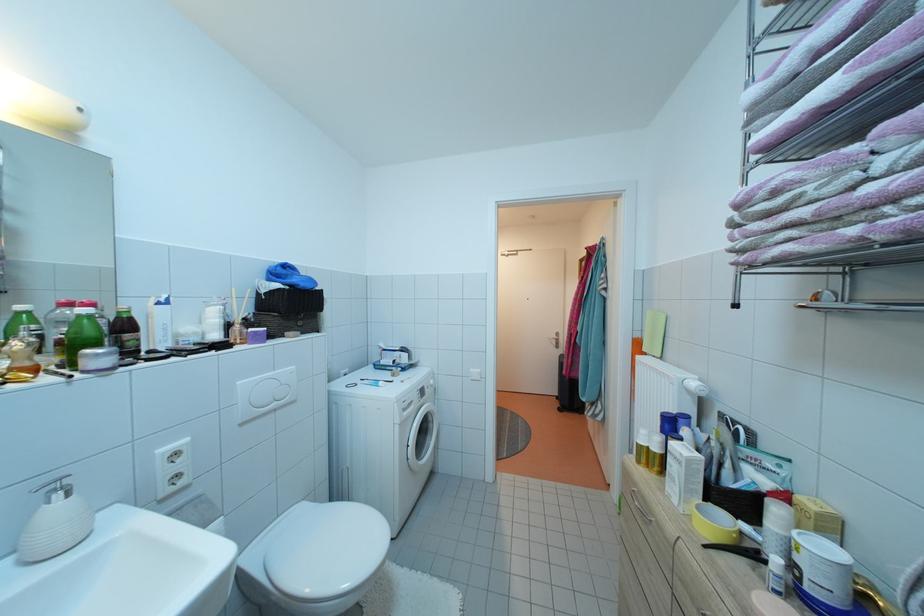
Find where to press the soap dispenser pump. Please return your answer as a coordinate pair (x, y).

(57, 493)